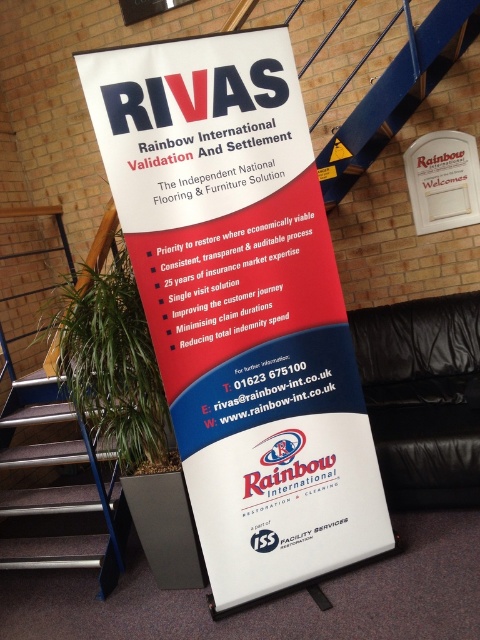
Question: Which point is closer to the camera taking this photo?

Choices:
 (A) (172, 385)
 (B) (24, 522)

Answer: (A)

Question: Is white paper poster at center smaller than brown carpeted stairs at lower left?

Choices:
 (A) yes
 (B) no

Answer: (A)

Question: Does white paper poster at center appear over brown carpeted stairs at lower left?

Choices:
 (A) no
 (B) yes

Answer: (B)

Question: Is white paper poster at center positioned at the back of brown carpeted stairs at lower left?

Choices:
 (A) no
 (B) yes

Answer: (A)

Question: Which point is farther to the camera?

Choices:
 (A) brown carpeted stairs at lower left
 (B) white paper poster at center

Answer: (A)